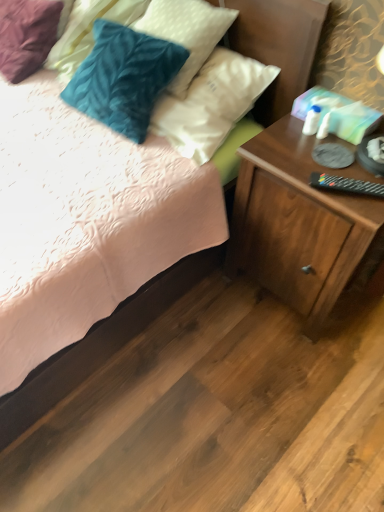
This screenshot has width=384, height=512. In order to click on free space on the front side of wooden nightstand at lower right in this screenshot , I will do `click(285, 371)`.